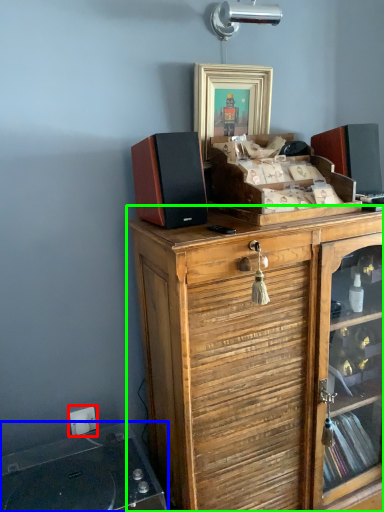
Question: Which object is positioned closest to electric outlet (highlighted by a red box)? Select from wide (highlighted by a blue box) and cabinetry (highlighted by a green box).

Choices:
 (A) wide
 (B) cabinetry

Answer: (A)